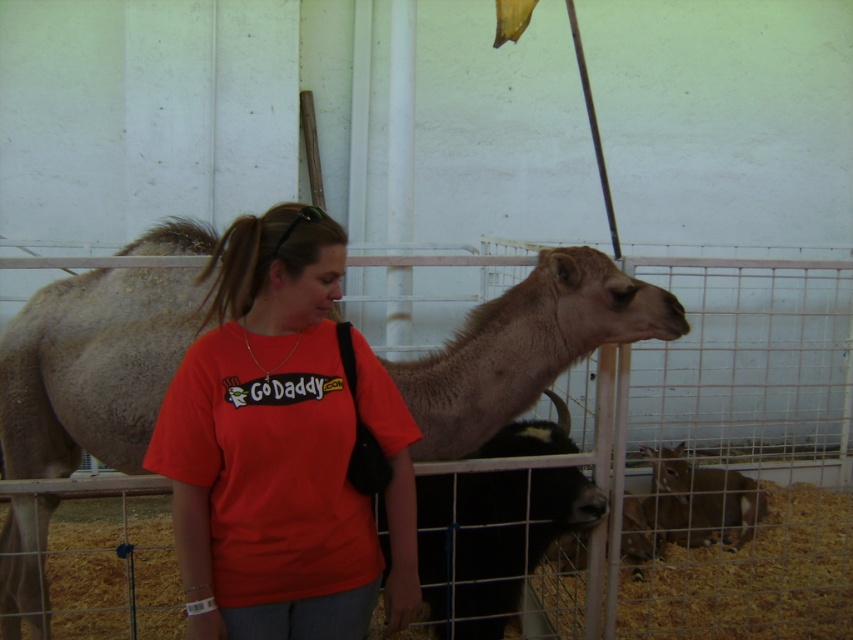
Is point (431, 484) farther from viewer compared to point (654, 525)?

No, (431, 484) is in front of (654, 525).

Is black woolly cow at center behind brown fur goat at lower right?

That is False.

Who is more distant from viewer, [569,440] or [659,499]?

Positioned behind is point [659,499].

Image resolution: width=853 pixels, height=640 pixels. In order to click on black woolly cow at center in this screenshot , I will do `click(492, 540)`.

Does red cotton shirt at center appear under light brown fur at center?

No, red cotton shirt at center is not below light brown fur at center.

Who is higher up, red cotton shirt at center or light brown fur at center?

red cotton shirt at center is higher up.

Is point (329, 248) behind point (207, 252)?

No, it is not.

Locate an element on the screen. The height and width of the screenshot is (640, 853). red cotton shirt at center is located at coordinates (268, 444).

Between red cotton shirt at center and brown fur goat at lower right, which one appears on the left side from the viewer's perspective?

red cotton shirt at center is more to the left.

Who is more distant from viewer, (225, 273) or (653, 518)?

The point (653, 518) is behind.

Identify the location of red cotton shirt at center. Image resolution: width=853 pixels, height=640 pixels. (268, 444).